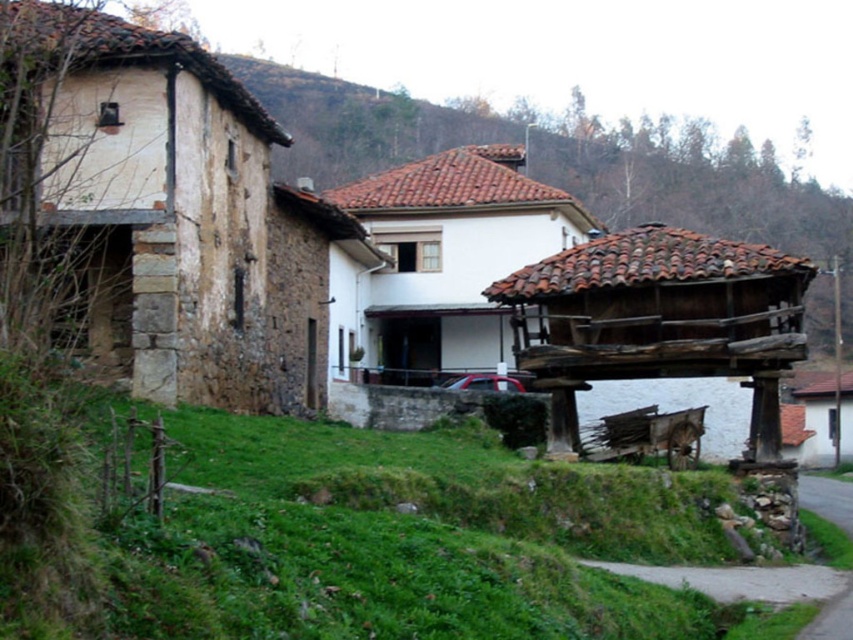
Question: Which point appears farthest from the camera in this image?

Choices:
 (A) (543, 224)
 (B) (579, 314)
 (C) (804, 396)
 (D) (312, 349)

Answer: (C)

Question: Which is nearer to the stone textured hut at left?

Choices:
 (A) wooden hut at center
 (B) white stucco house at center

Answer: (B)

Question: Among these points, which one is farthest from the camera?

Choices:
 (A) (405, 124)
 (B) (532, 193)
 (C) (798, 376)

Answer: (A)

Question: Is brown stone house at center further to the viewer compared to brown wooden hut at right?

Choices:
 (A) yes
 (B) no

Answer: (A)

Question: Can you confirm if brown stone house at center is positioned to the right of brown wooden hut at right?

Choices:
 (A) yes
 (B) no

Answer: (B)

Question: Is wooden hut at center to the left of white stucco house at center from the viewer's perspective?

Choices:
 (A) yes
 (B) no

Answer: (B)